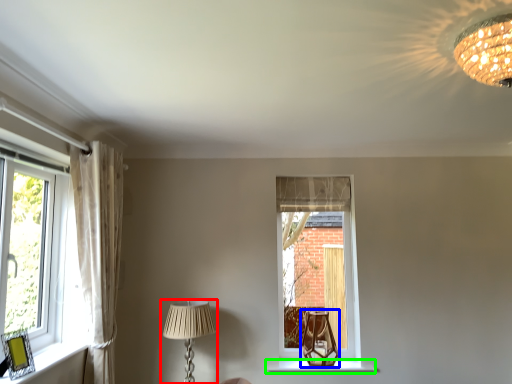
Question: Which object is positioned closest to lamp (highlighted by a red box)? Select from table lamp (highlighted by a blue box) and window sill (highlighted by a green box).

Choices:
 (A) table lamp
 (B) window sill

Answer: (B)